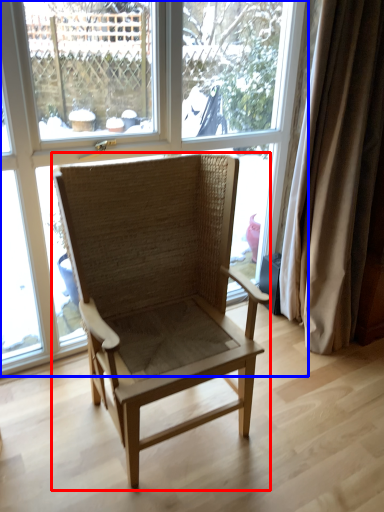
Question: Which object appears farthest to the camera in this image, chair (highlighted by a red box) or window (highlighted by a blue box)?

Choices:
 (A) chair
 (B) window

Answer: (B)